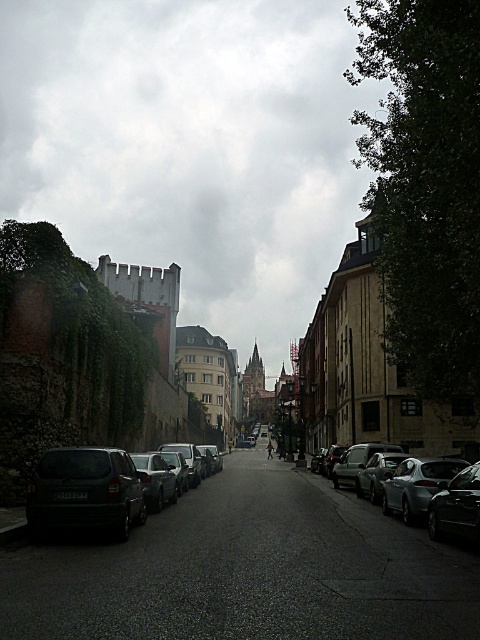
You are standing at the camera position and want to walk to the shiny silver sedan at right. The path is clear except for a 1.2 meter wide tree trunk blocking the way. Can you walk around the tree trunk to reach the sedan?

Yes, you can walk around the tree trunk to reach the shiny silver sedan at right since the distance between you and the sedan is 14.65 meters, which is more than enough space to maneuver around the obstacle.

You are a delivery driver trying to park your van in this street. You see a silver metallic sedan at right and a shiny black car at lower right. Which car is positioned more towards the east side of the street?

The silver metallic sedan at right is positioned more towards the east side of the street because it is to the right of the shiny black car at lower right, and since the street is oriented with the right side being eastward.

You are a pedestrian standing at the center of the street looking towards the right side. You see the shiny silver sedan at right and the shiny black car at lower right. Which car is positioned more to the right?

The shiny silver sedan at right is positioned more to the right than the shiny black car at lower right.